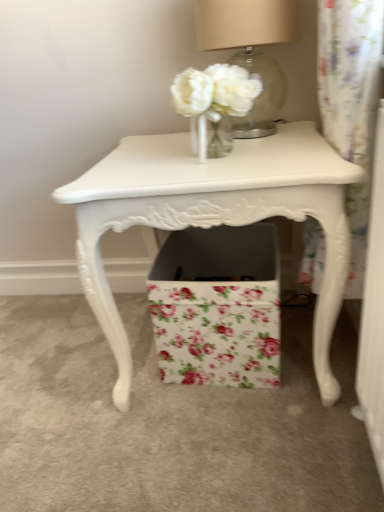
Question: Does white painted wood table at center lie in front of floral paper box at center?

Choices:
 (A) yes
 (B) no

Answer: (A)

Question: Is white painted wood table at center at the left side of floral paper box at center?

Choices:
 (A) no
 (B) yes

Answer: (B)

Question: Is white painted wood table at center wider than floral paper box at center?

Choices:
 (A) no
 (B) yes

Answer: (B)

Question: Are white painted wood table at center and floral paper box at center located far from each other?

Choices:
 (A) yes
 (B) no

Answer: (B)

Question: Considering the relative sizes of white painted wood table at center and floral paper box at center in the image provided, is white painted wood table at center shorter than floral paper box at center?

Choices:
 (A) yes
 (B) no

Answer: (B)

Question: From a real-world perspective, is white painted wood table at center over floral paper box at center?

Choices:
 (A) no
 (B) yes

Answer: (B)

Question: From a real-world perspective, is floral paper box at center physically above white painted wood table at center?

Choices:
 (A) yes
 (B) no

Answer: (B)

Question: Can you confirm if floral paper box at center is wider than white painted wood table at center?

Choices:
 (A) yes
 (B) no

Answer: (B)

Question: Is floral paper box at center placed right next to white painted wood table at center?

Choices:
 (A) yes
 (B) no

Answer: (B)

Question: Can you confirm if floral paper box at center is thinner than white painted wood table at center?

Choices:
 (A) yes
 (B) no

Answer: (A)

Question: From the image's perspective, is floral paper box at center below white painted wood table at center?

Choices:
 (A) no
 (B) yes

Answer: (B)

Question: Is floral paper box at center to the left of white painted wood table at center from the viewer's perspective?

Choices:
 (A) no
 (B) yes

Answer: (A)

Question: Is matte beige lampshade at upper center not within white painted wood table at center?

Choices:
 (A) no
 (B) yes

Answer: (B)